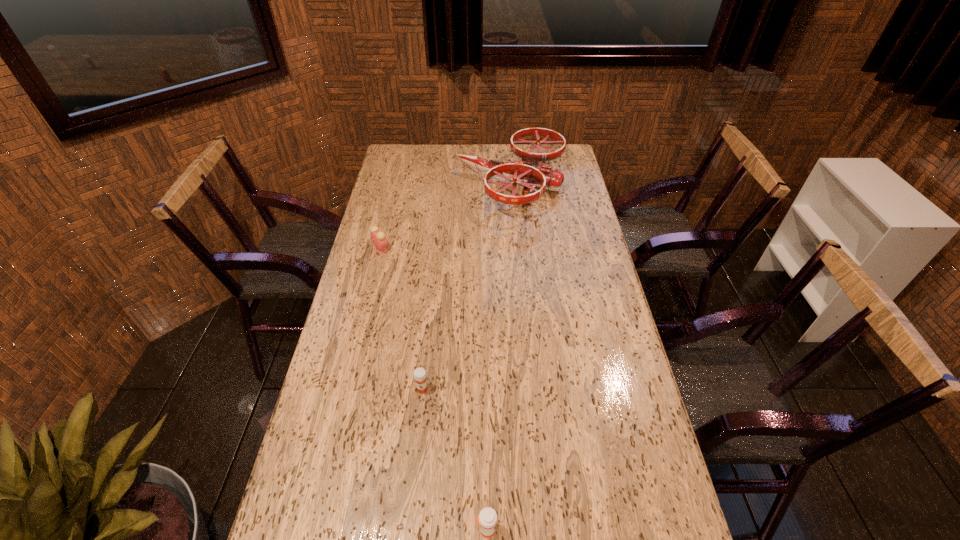
You are a GUI agent. You are given a task and a screenshot of the screen. Output one action in this format:
    pyautogui.click(x=<x>, y=<y>)
    Task: Click on the vacant space located 0.370m on the back of the nearer medicine
    
    Given the screenshot: What is the action you would take?
    pyautogui.click(x=485, y=376)

Find the location of a particular element. The width and height of the screenshot is (960, 540). blank space located 0.100m on the label side of the left medicine is located at coordinates (419, 429).

Identify the location of object that is at the far edge. Image resolution: width=960 pixels, height=540 pixels. (528, 173).

The image size is (960, 540). Identify the location of object located at the left edge. (378, 238).

Identify the location of object located in the right edge section of the desktop. The width and height of the screenshot is (960, 540). [x=528, y=173].

Image resolution: width=960 pixels, height=540 pixels. What are the coordinates of `object located in the far right corner section of the desktop` in the screenshot? It's located at (528, 173).

This screenshot has height=540, width=960. I want to click on free space at the far edge of the desktop, so click(x=504, y=154).

Locate an element on the screen. vacant space at the left edge is located at coordinates (384, 191).

The image size is (960, 540). I want to click on vacant space at the right edge of the desktop, so click(x=593, y=299).

The height and width of the screenshot is (540, 960). In the image, there is a desktop. What are the coordinates of `vacant space at the far right corner` in the screenshot? It's located at (553, 167).